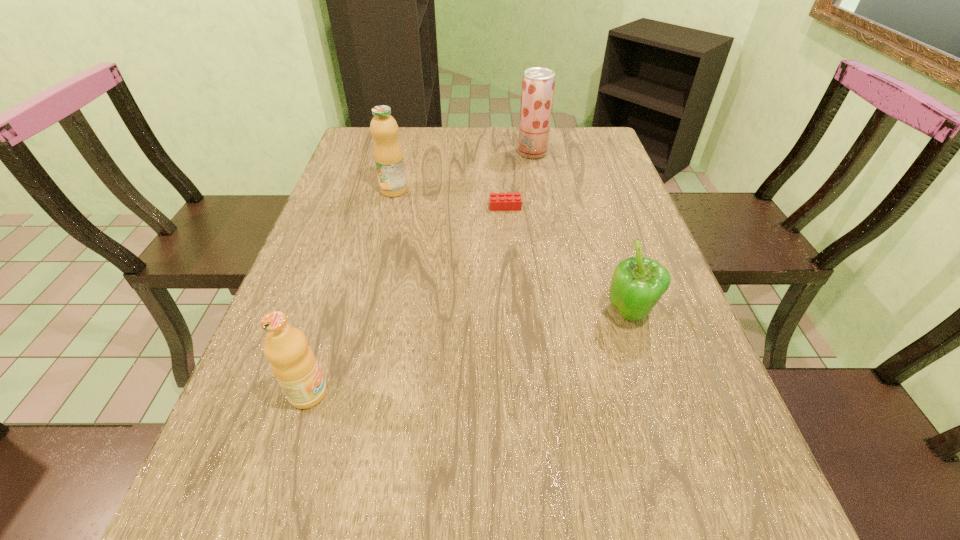
You are a GUI agent. You are given a task and a screenshot of the screen. Output one action in this format:
    pyautogui.click(x=<x>, y=<y>)
    Task: Click on the vacant area situated 0.310m on the front label of the second farthest fruit juice
    
    Given the screenshot: What is the action you would take?
    pyautogui.click(x=372, y=274)

Identify the location of free space located on the front label of the nearest fruit juice. The height and width of the screenshot is (540, 960). (395, 393).

Locate an element on the screen. The height and width of the screenshot is (540, 960). vacant space located on the front of the bell pepper is located at coordinates (645, 359).

You are a GUI agent. You are given a task and a screenshot of the screen. Output one action in this format:
    pyautogui.click(x=<x>, y=<y>)
    Task: Click on the free location located 0.400m on the left of the third object from left to right
    
    Given the screenshot: What is the action you would take?
    pyautogui.click(x=344, y=206)

Identify the location of object present at the far edge. (538, 83).

This screenshot has height=540, width=960. I want to click on object that is at the right edge, so click(637, 284).

The width and height of the screenshot is (960, 540). I want to click on vacant area at the far edge of the desktop, so click(418, 132).

Identify the location of vacant space at the left edge of the desktop. (330, 271).

At what (x,y) coordinates should I click in order to perform the action: click on blank space at the right edge. Please return your answer as a coordinate pair (x, y). Looking at the image, I should click on (654, 258).

You are a GUI agent. You are given a task and a screenshot of the screen. Output one action in this format:
    pyautogui.click(x=<x>, y=<y>)
    Task: Click on the vacant area at the far right corner of the desktop
    This screenshot has width=960, height=540.
    Given the screenshot: What is the action you would take?
    pyautogui.click(x=561, y=135)